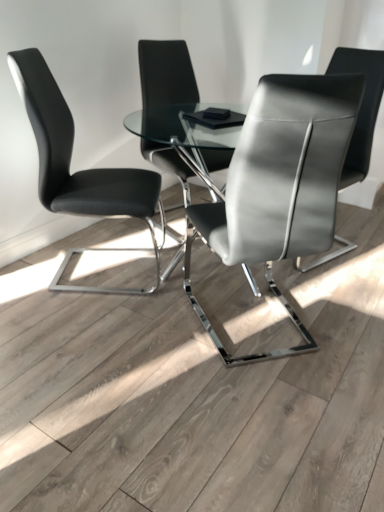
Question: From the image's perspective, does satin gray leather chair at center, marked as the second chair in a right-to-left arrangement, appear higher than satin black chair at center, positioned as the 1th chair in right-to-left order?

Choices:
 (A) yes
 (B) no

Answer: (B)

Question: Considering the relative positions of satin gray leather chair at center, marked as the second chair in a right-to-left arrangement, and satin black chair at center, the 4th chair positioned from the left, in the image provided, is satin gray leather chair at center, marked as the second chair in a right-to-left arrangement, to the right of satin black chair at center, the 4th chair positioned from the left, from the viewer's perspective?

Choices:
 (A) no
 (B) yes

Answer: (A)

Question: Is satin gray leather chair at center, marked as the second chair in a right-to-left arrangement, with satin black chair at center, the 4th chair positioned from the left?

Choices:
 (A) yes
 (B) no

Answer: (B)

Question: Is satin gray leather chair at center, marked as the second chair in a right-to-left arrangement, to the left of satin black chair at center, the 4th chair positioned from the left, from the viewer's perspective?

Choices:
 (A) no
 (B) yes

Answer: (B)

Question: From a real-world perspective, is satin gray leather chair at center, marked as the second chair in a right-to-left arrangement, located higher than satin black chair at center, positioned as the 1th chair in right-to-left order?

Choices:
 (A) yes
 (B) no

Answer: (A)

Question: Is satin gray leather chair at center, placed as the 3th chair when sorted from left to right, behind satin black chair at center, positioned as the 1th chair in right-to-left order?

Choices:
 (A) yes
 (B) no

Answer: (B)

Question: Is matte black chair at center, arranged as the third chair when viewed from the right, at the right side of satin gray leather chair at center, placed as the 3th chair when sorted from left to right?

Choices:
 (A) yes
 (B) no

Answer: (B)

Question: Is matte black chair at center, the second chair positioned from the left, at the left side of satin gray leather chair at center, marked as the second chair in a right-to-left arrangement?

Choices:
 (A) yes
 (B) no

Answer: (A)

Question: From the image's perspective, is matte black chair at center, arranged as the third chair when viewed from the right, over satin gray leather chair at center, marked as the second chair in a right-to-left arrangement?

Choices:
 (A) no
 (B) yes

Answer: (B)

Question: Is matte black chair at center, arranged as the third chair when viewed from the right, facing away from satin gray leather chair at center, marked as the second chair in a right-to-left arrangement?

Choices:
 (A) yes
 (B) no

Answer: (B)

Question: Would you say matte black chair at center, the second chair positioned from the left, is outside satin gray leather chair at center, placed as the 3th chair when sorted from left to right?

Choices:
 (A) yes
 (B) no

Answer: (A)

Question: Does matte black chair at center, the second chair positioned from the left, come behind satin gray leather chair at center, placed as the 3th chair when sorted from left to right?

Choices:
 (A) no
 (B) yes

Answer: (B)

Question: Is satin gray leather chair at center, marked as the second chair in a right-to-left arrangement, at the left side of matte black chair at center, arranged as the third chair when viewed from the right?

Choices:
 (A) no
 (B) yes

Answer: (A)